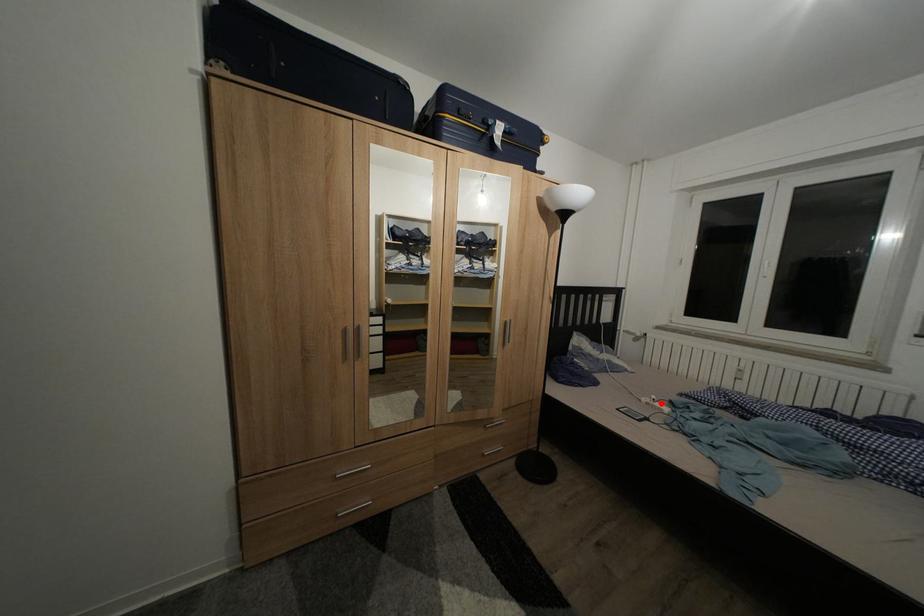
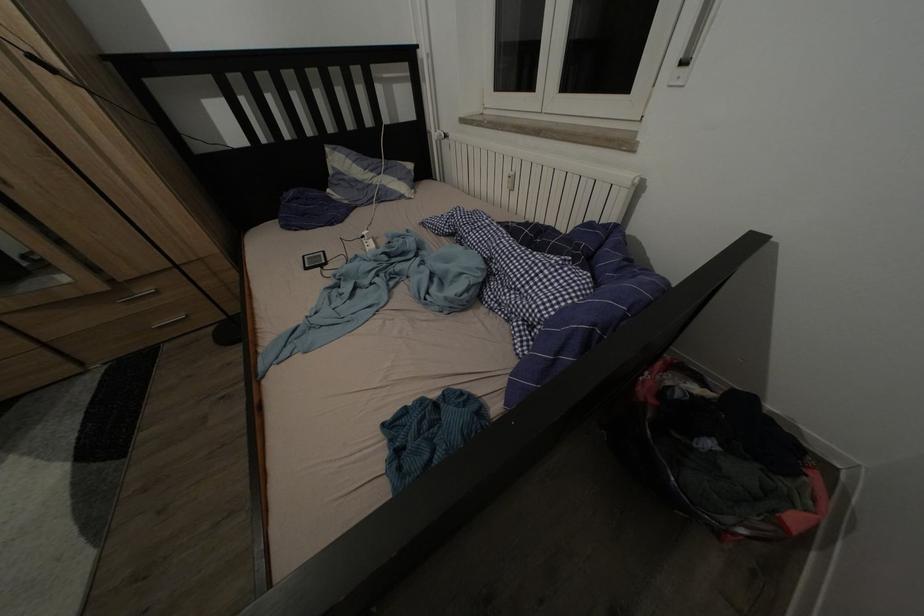
In the second image, find the point that corresponds to the highlighted location in the first image.

(372, 238)